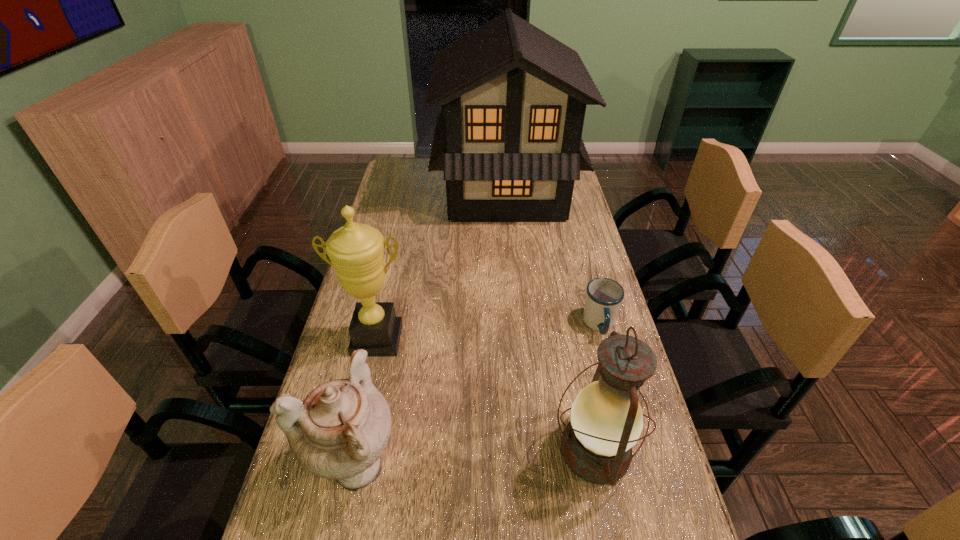
This screenshot has width=960, height=540. What are the coordinates of `vacant region that satisfies the following two spatial constraints: 1. at the front of the trophy cup with handles; 2. on the left side of the urn` in the screenshot? It's located at (348, 465).

What are the coordinates of `free space that satisfies the following two spatial constraints: 1. on the back side of the oil lamp; 2. on the front-facing side of the tallest object` in the screenshot? It's located at (542, 191).

Where is `vacant space that satisfies the following two spatial constraints: 1. at the front of the trophy cup with handles; 2. on the right side of the oil lamp`? vacant space that satisfies the following two spatial constraints: 1. at the front of the trophy cup with handles; 2. on the right side of the oil lamp is located at coordinates (352, 450).